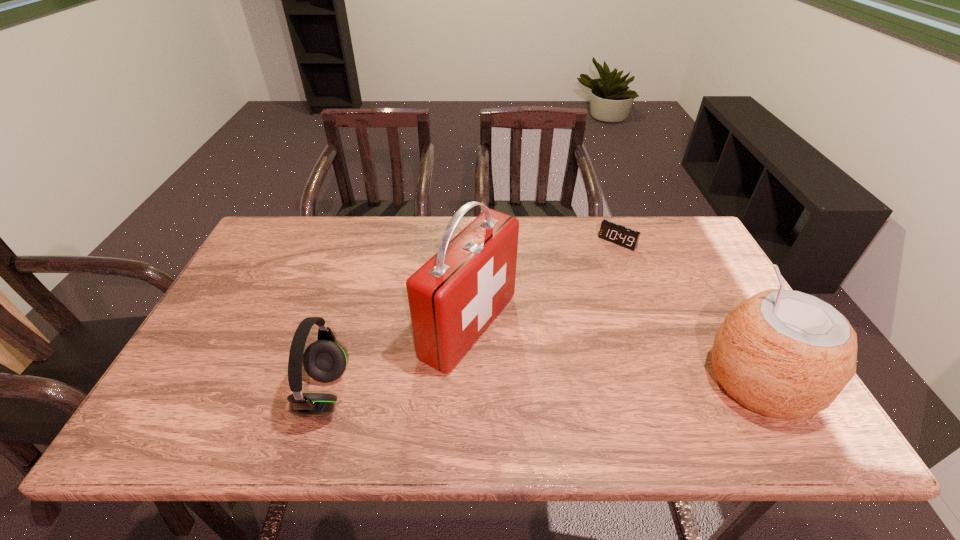
Where is `free space located on the ear cups of the headset`? The width and height of the screenshot is (960, 540). free space located on the ear cups of the headset is located at coordinates (197, 393).

In order to click on vacant position located 0.200m on the back of the third shortest object in this screenshot , I will do `click(707, 286)`.

Locate an element on the screen. free region located 0.090m on the front face of the first-aid kit is located at coordinates (543, 368).

Locate an element on the screen. The image size is (960, 540). free point located on the front face of the first-aid kit is located at coordinates (566, 380).

In order to click on vacant space located 0.060m on the front face of the first-aid kit in this screenshot , I will do `click(533, 363)`.

The image size is (960, 540). In order to click on free point located 0.390m on the front-facing side of the alarm clock in this screenshot , I will do `click(548, 323)`.

Where is `vacant point located 0.150m on the front-facing side of the alarm clock`? The height and width of the screenshot is (540, 960). vacant point located 0.150m on the front-facing side of the alarm clock is located at coordinates (588, 275).

Find the location of a particular element. This screenshot has height=540, width=960. vacant region located on the front-facing side of the alarm clock is located at coordinates (602, 259).

Find the location of `object that is at the far edge`. object that is at the far edge is located at coordinates pos(628,238).

Where is `headset situated at the near edge`? The height and width of the screenshot is (540, 960). headset situated at the near edge is located at coordinates (325, 360).